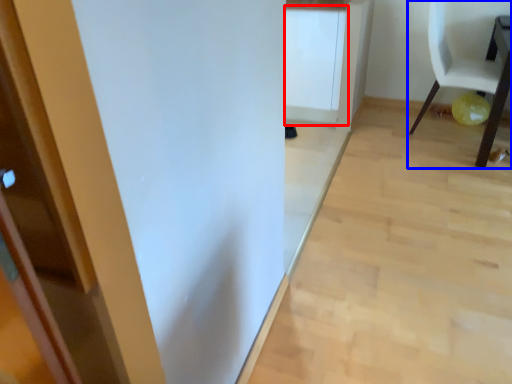
Question: Among these objects, which one is nearest to the camera, cabinetry (highlighted by a red box) or chair (highlighted by a blue box)?

Choices:
 (A) cabinetry
 (B) chair

Answer: (B)